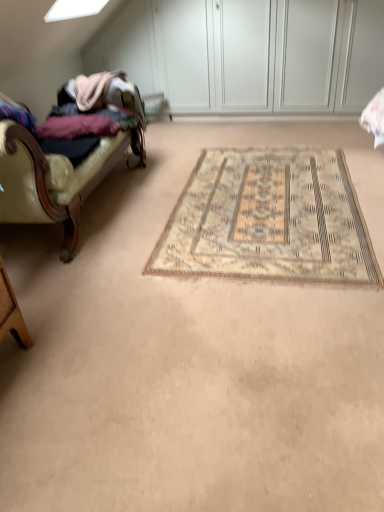
Question: Based on their positions, is beige woven rug at center located to the left or right of leather couch at left?

Choices:
 (A) left
 (B) right

Answer: (B)

Question: In terms of width, does beige woven rug at center look wider or thinner when compared to leather couch at left?

Choices:
 (A) thin
 (B) wide

Answer: (B)

Question: Is point (362, 253) positioned closer to the camera than point (67, 199)?

Choices:
 (A) farther
 (B) closer

Answer: (B)

Question: Is point (28, 141) positioned closer to the camera than point (321, 229)?

Choices:
 (A) closer
 (B) farther

Answer: (A)

Question: Considering the positions of leather couch at left and beige woven rug at center in the image, is leather couch at left wider or thinner than beige woven rug at center?

Choices:
 (A) wide
 (B) thin

Answer: (B)

Question: Would you say leather couch at left is inside or outside beige woven rug at center?

Choices:
 (A) inside
 (B) outside

Answer: (B)

Question: Is leather couch at left to the left or to the right of beige woven rug at center in the image?

Choices:
 (A) right
 (B) left

Answer: (B)